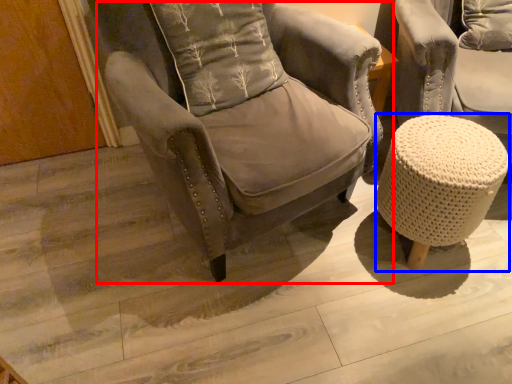
Question: Which object appears closest to the camera in this image, chair (highlighted by a red box) or bar stool (highlighted by a blue box)?

Choices:
 (A) chair
 (B) bar stool

Answer: (A)